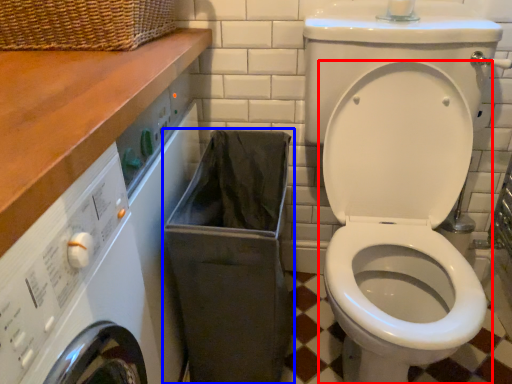
Question: Which object is closer to the camera taking this photo, toilet (highlighted by a red box) or laundry basket (highlighted by a blue box)?

Choices:
 (A) toilet
 (B) laundry basket

Answer: (A)